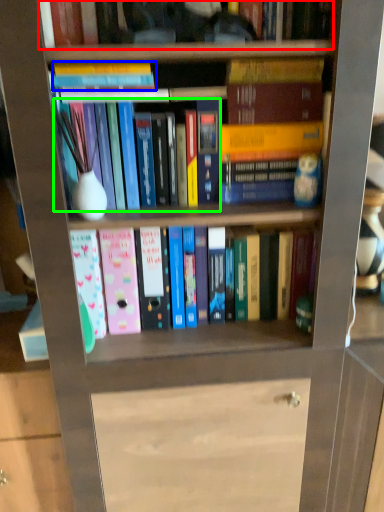
Question: Estimate the real-world distances between objects in this image. Which object is closer to book (highlighted by a red box), book (highlighted by a blue box) or book (highlighted by a green box)?

Choices:
 (A) book
 (B) book

Answer: (A)